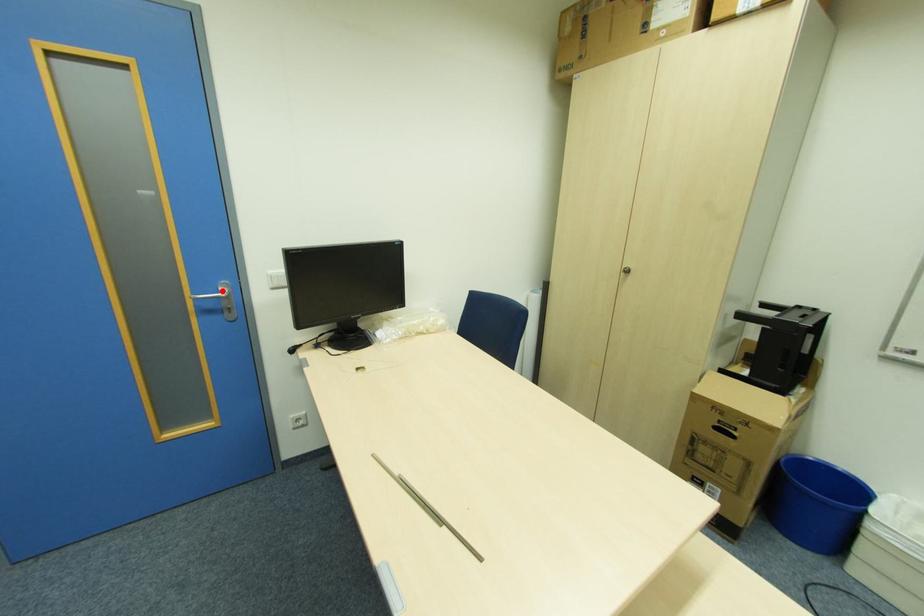
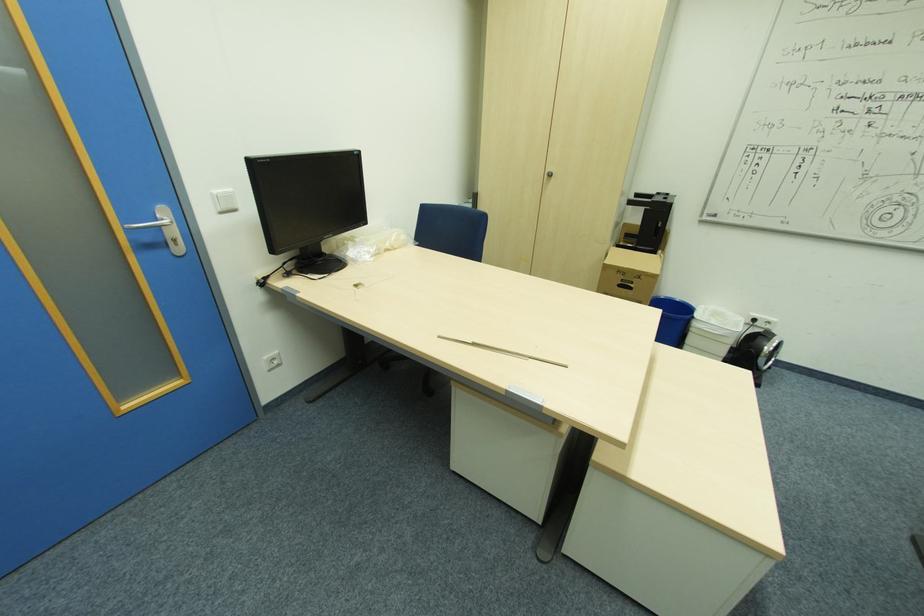
In the second image, find the point that corresponds to the highlighted location in the first image.

(161, 220)